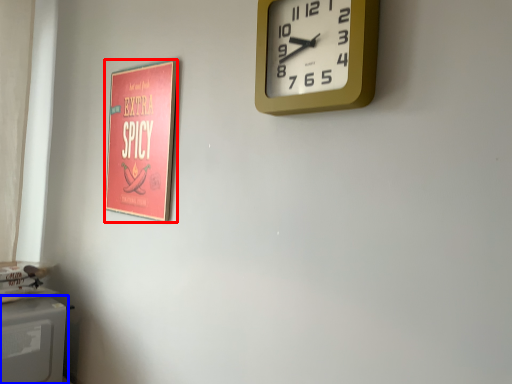
Question: Which object is further to the camera taking this photo, poster page (highlighted by a red box) or appliance (highlighted by a blue box)?

Choices:
 (A) poster page
 (B) appliance

Answer: (B)